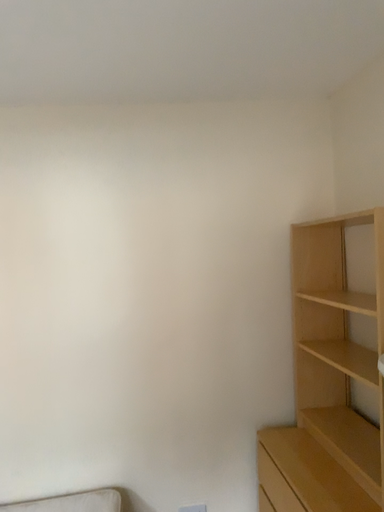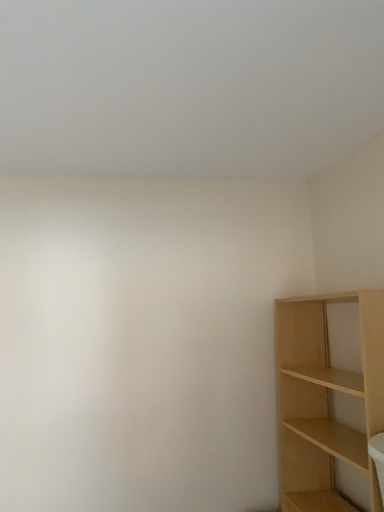
Question: Which way did the camera rotate in the video?

Choices:
 (A) rotated upward
 (B) rotated downward

Answer: (A)